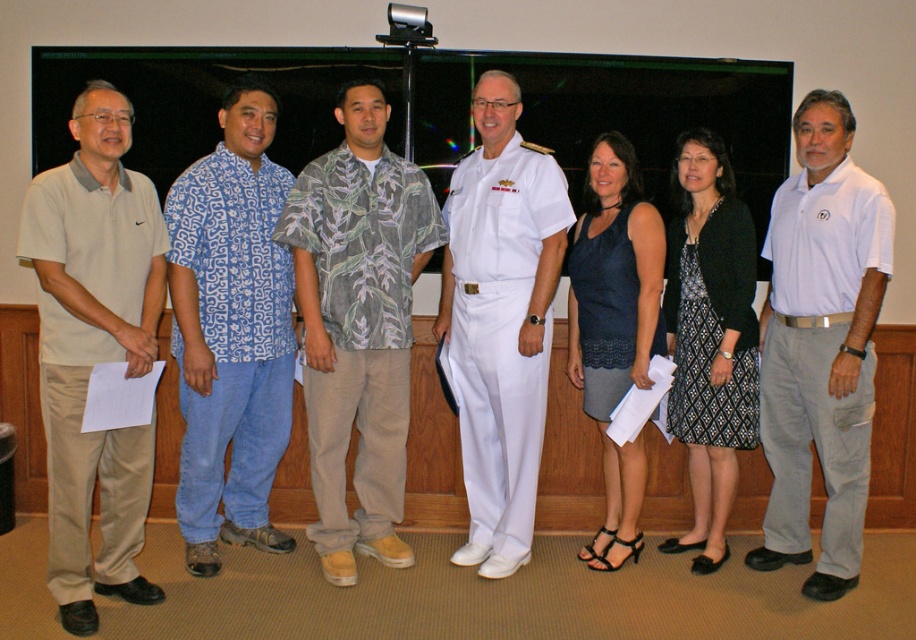
Question: Among these points, which one is farthest from the camera?

Choices:
 (A) (503, 108)
 (B) (696, 300)
 (C) (382, 513)

Answer: (C)

Question: Is the position of blue printed shirt at center more distant than that of black textured dress at center?

Choices:
 (A) yes
 (B) no

Answer: (B)

Question: Does beige cotton polo shirt at left come behind navy blue fabric dress at center?

Choices:
 (A) no
 (B) yes

Answer: (A)

Question: Is beige cotton polo shirt at left wider than printed fabric shirt at center?

Choices:
 (A) no
 (B) yes

Answer: (A)

Question: Which point is closer to the camera?

Choices:
 (A) (718, 161)
 (B) (592, 545)

Answer: (A)

Question: Which point is closer to the camera?

Choices:
 (A) blue printed shirt at center
 (B) printed fabric shirt at center

Answer: (A)